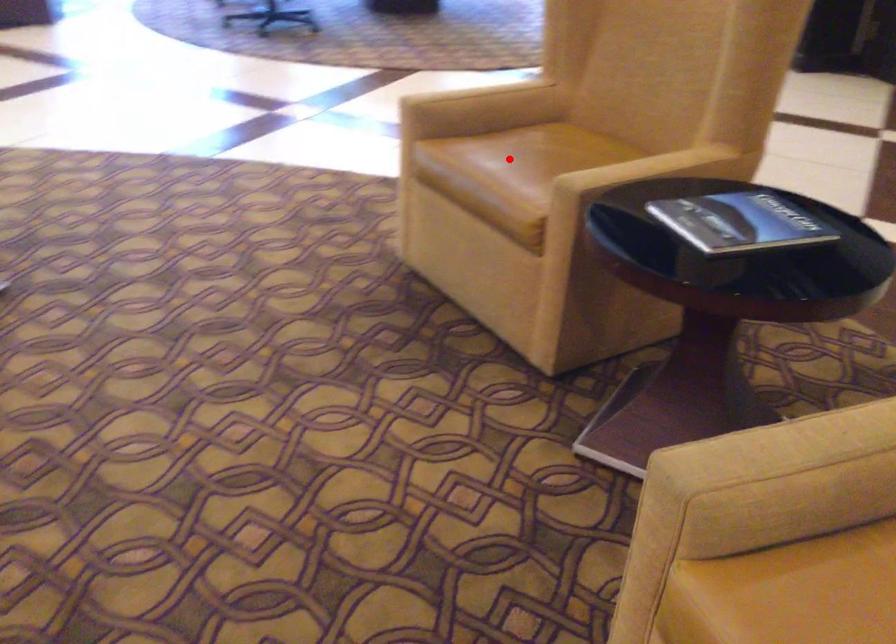
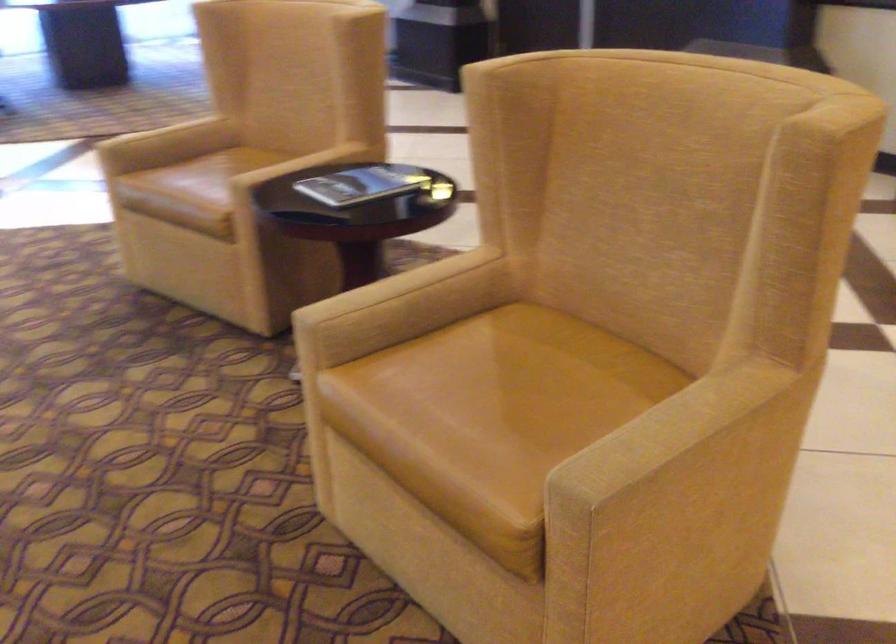
Find the pixel in the second image that matches the highlighted location in the first image.

(199, 176)